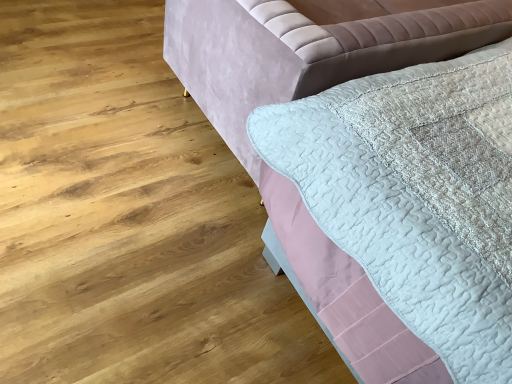
The height and width of the screenshot is (384, 512). What do you see at coordinates (312, 94) in the screenshot?
I see `velvet bed at upper right` at bounding box center [312, 94].

Where is `velvet bed at upper right`? velvet bed at upper right is located at coordinates (312, 94).

You are a GUI agent. You are given a task and a screenshot of the screen. Output one action in this format:
    pyautogui.click(x=<x>, y=<y>)
    Task: Click on the velvet bed at upper right
    
    Given the screenshot: What is the action you would take?
    pyautogui.click(x=312, y=94)